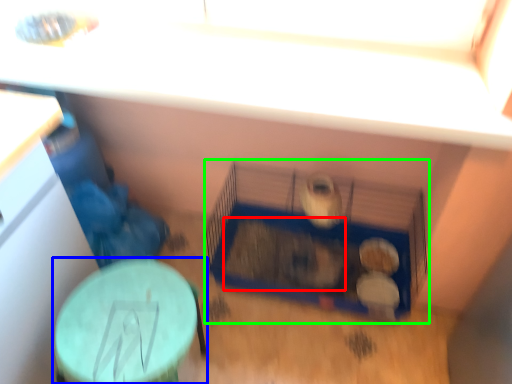
Question: Estimate the real-world distances between objects in this image. Which object is closer to animal (highlighted by a red box), table (highlighted by a blue box) or bird cage (highlighted by a green box)?

Choices:
 (A) table
 (B) bird cage

Answer: (B)